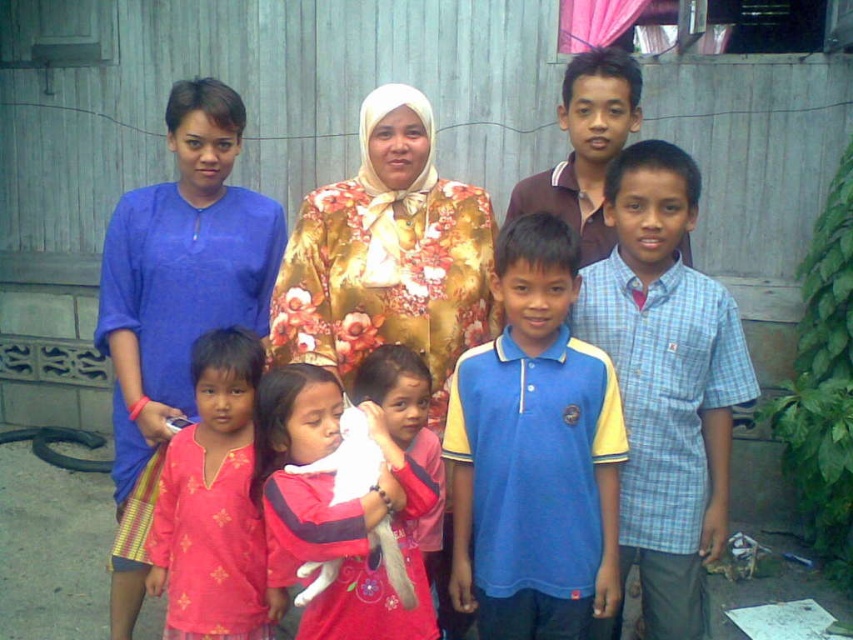
You are a photographer trying to arrange the two children wearing the light blue plaid shirt at right and the blue cotton shirt at left for a better group photo. Which child should you move to the left to make them stand side by side?

You should move the light blue plaid shirt at right to the left so that it is positioned next to the blue cotton shirt at left, as the light blue plaid shirt at right is currently on the right side of the blue cotton shirt at left.

You are a photographer trying to adjust the composition of this family photo. You notice the blue cotton shirt at left and the pink fabric at center. Which object should you move closer to the camera to make them appear the same height in the photo?

The blue cotton shirt at left is much taller than the pink fabric at center, so you should move the pink fabric at center closer to the camera to make them appear the same height.